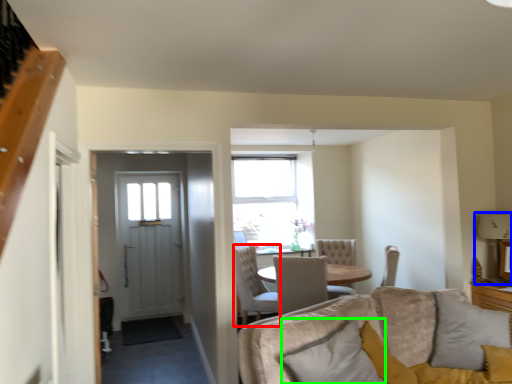
Question: Which object is positioned closest to chair (highlighted by a red box)? Select from lamp (highlighted by a blue box) and pillow (highlighted by a green box).

Choices:
 (A) lamp
 (B) pillow

Answer: (B)